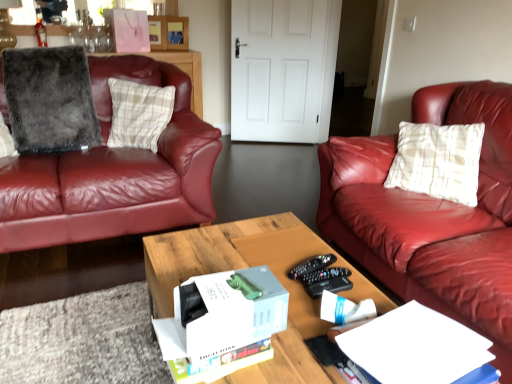
This screenshot has height=384, width=512. Find the location of `free space above wooden coffee table at center (from a real-world perspective)`. free space above wooden coffee table at center (from a real-world perspective) is located at coordinates pos(278,274).